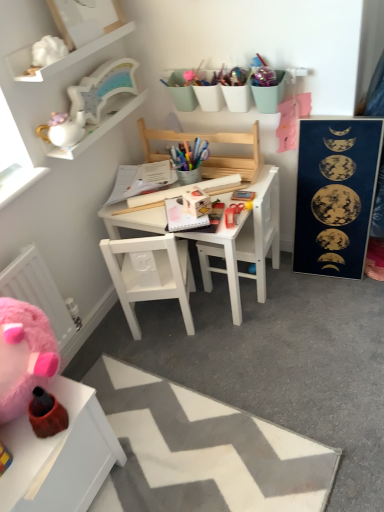
Image resolution: width=384 pixels, height=512 pixels. Identify the location of vacant space situated above white glossy mug at upper left (from a real-world perspective). (107, 112).